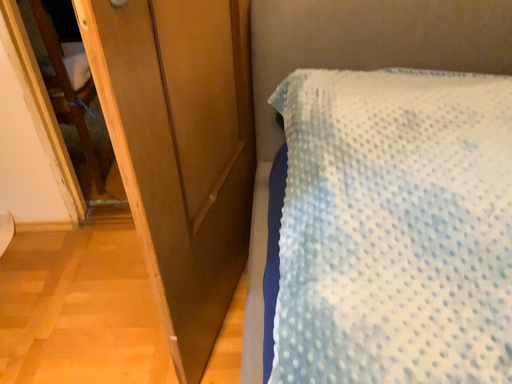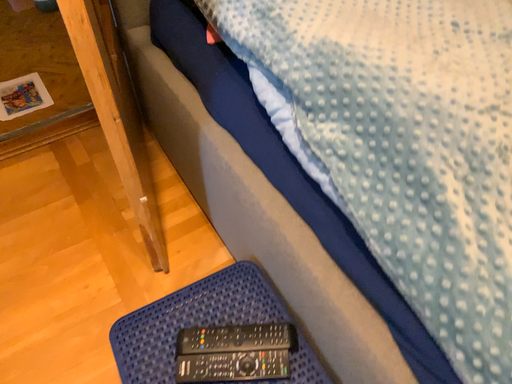
Question: How did the camera likely rotate when shooting the video?

Choices:
 (A) rotated left
 (B) rotated right

Answer: (B)